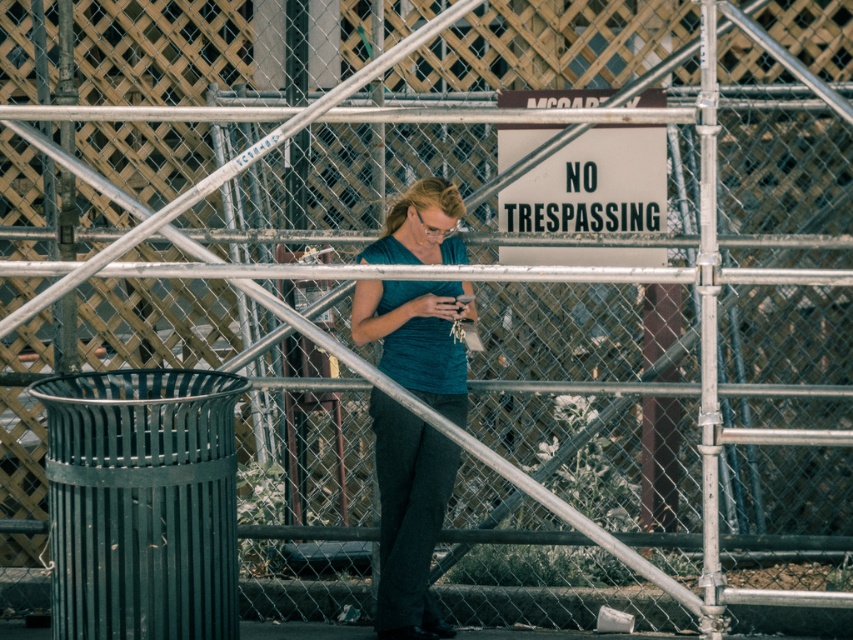
Locate an element on the screen. teal fabric shirt at center is located at coordinates (408, 516).

Does teal fabric shirt at center appear on the left side of white plastic sign at center?

Correct, you'll find teal fabric shirt at center to the left of white plastic sign at center.

Is point (434, 406) closer to camera compared to point (665, 161)?

Yes.

Image resolution: width=853 pixels, height=640 pixels. I want to click on teal fabric shirt at center, so click(x=408, y=516).